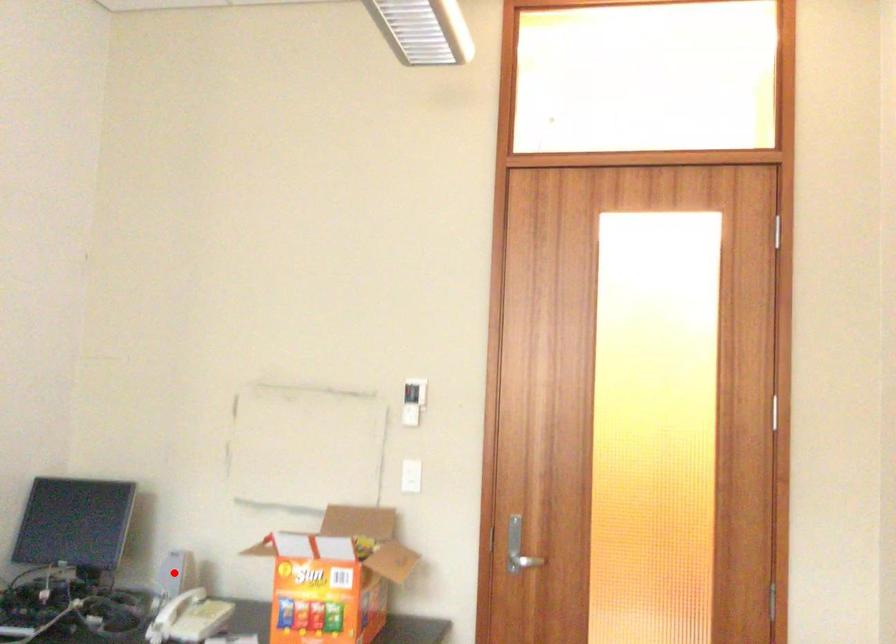
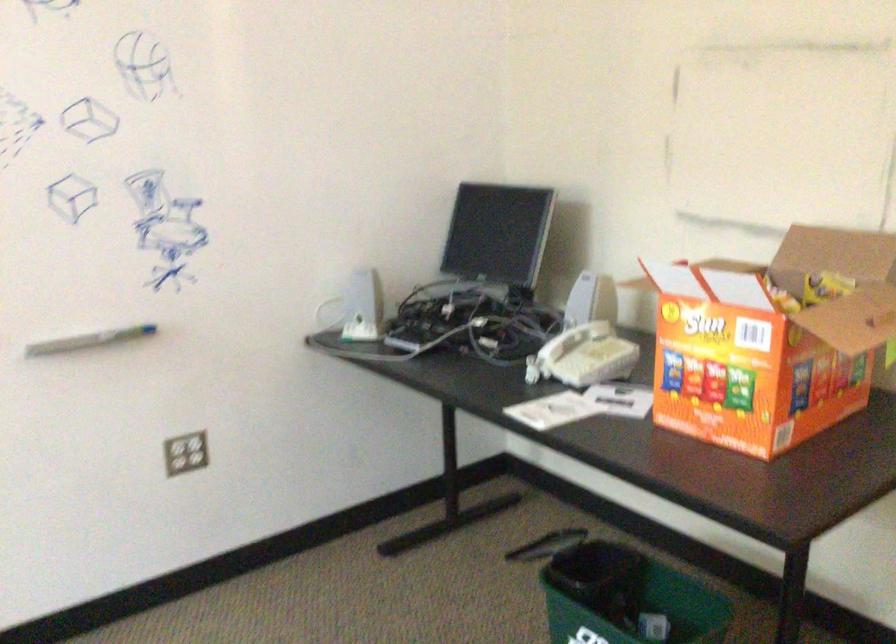
Question: I am providing you with two images of the same scene from different viewpoints. A red point is shown in image1. For the corresponding object point in image2, is it positioned nearer or farther from the camera?

Choices:
 (A) Nearer
 (B) Farther

Answer: (A)